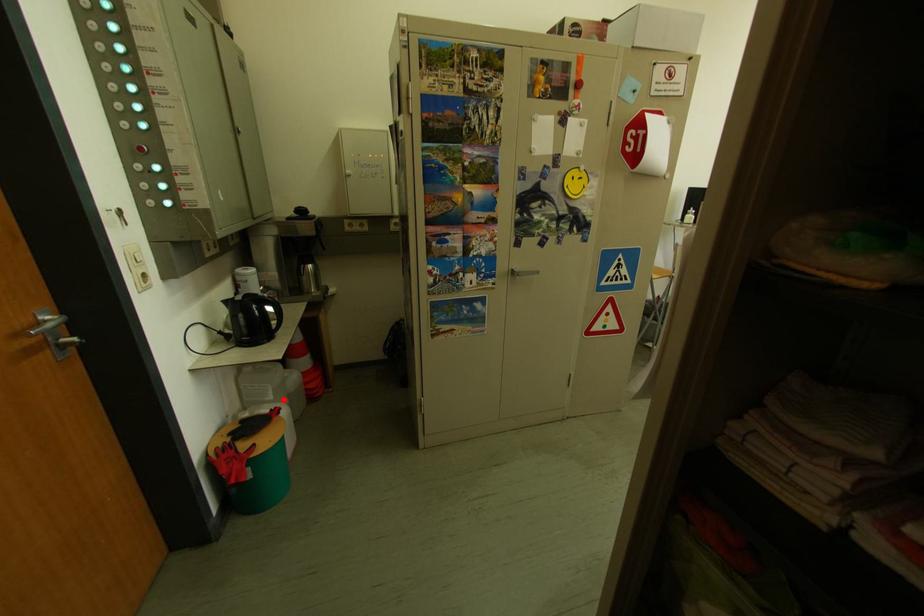
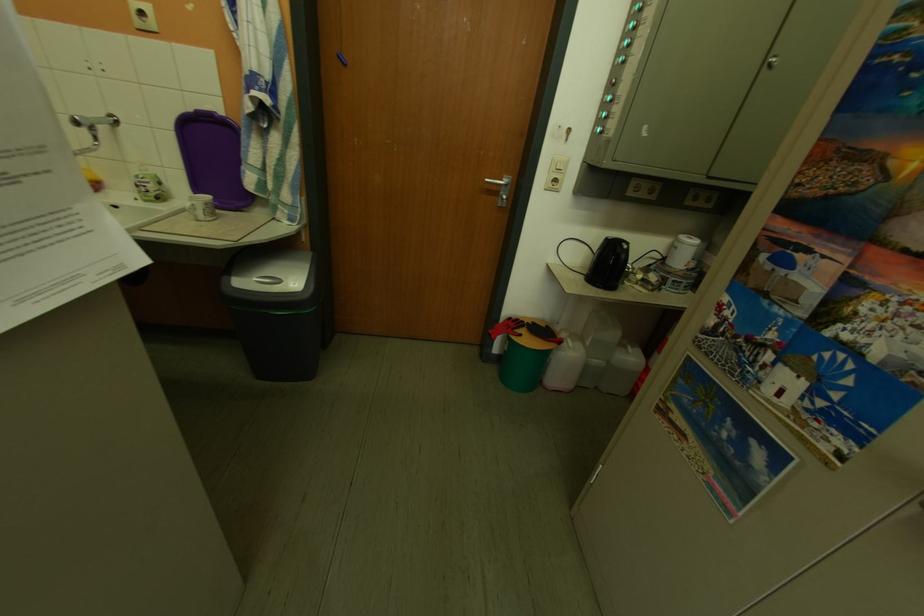
Question: A red point is marked in image1. In image2, is the corresponding 3D point closer to the camera or farther? Reply with the corresponding letter.

Choices:
 (A) The corresponding 3D point is closer.
 (B) The corresponding 3D point is farther.

Answer: (B)